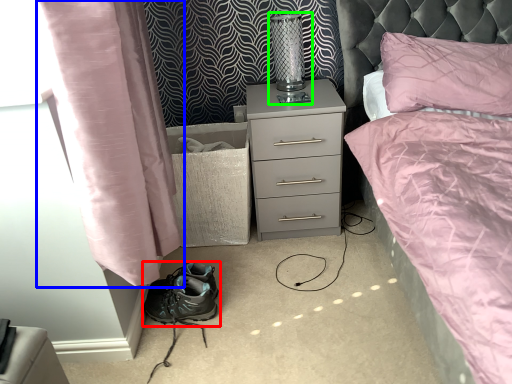
Question: Which is farther away from footwear (highlighted by a red box)? curtain (highlighted by a blue box) or bedside lamp (highlighted by a green box)?

Choices:
 (A) curtain
 (B) bedside lamp

Answer: (B)